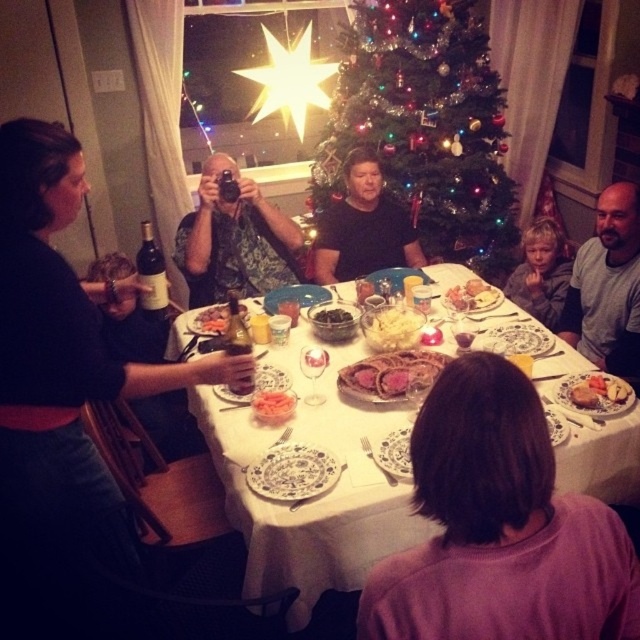
Question: Can you confirm if green glittering christmas tree at center is smaller than golden crispy pastry at center?

Choices:
 (A) yes
 (B) no

Answer: (B)

Question: Does white glossy table at center appear on the right side of green leafy salad at center?

Choices:
 (A) yes
 (B) no

Answer: (B)

Question: Which of these objects is positioned farthest from the porcelain plate at center?

Choices:
 (A) green leafy salad at center
 (B) black matte wine bottle at left
 (C) yellow crumbly cheese at center
 (D) pink matte food at center

Answer: (A)

Question: Among these objects, which one is farthest from the camera?

Choices:
 (A) green leafy salad at center
 (B) yellow crumbly cheese at center
 (C) golden brown bread at table center
 (D) green glittering christmas tree at center

Answer: (D)

Question: In this image, where is light brown hair at table center located relative to slightly browned meat at center?

Choices:
 (A) below
 (B) above

Answer: (B)

Question: Considering the real-world distances, which object is closest to the golden brown bread at table center?

Choices:
 (A) golden brown crusty bread at center
 (B) green leafy salad at center
 (C) golden crispy pastry at center
 (D) pink matte food at center

Answer: (A)